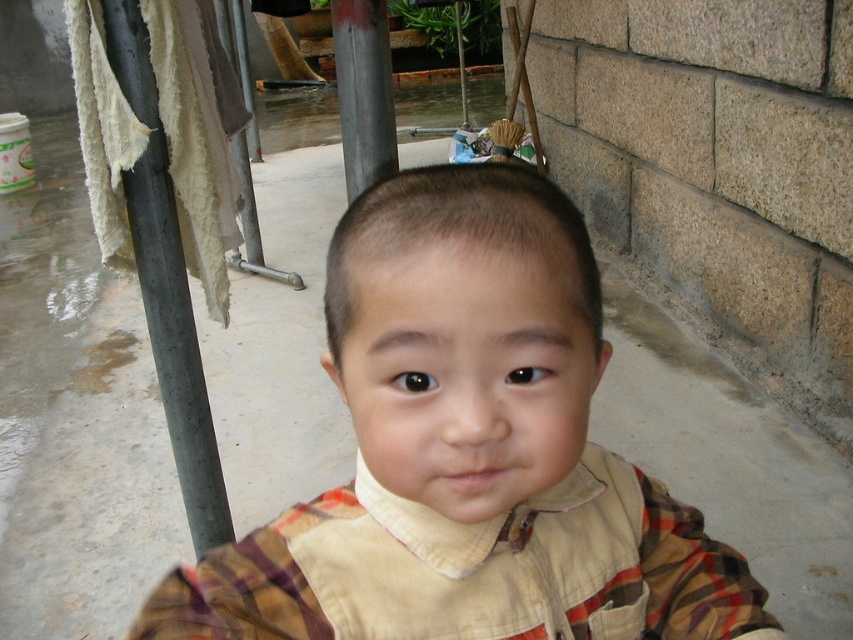
Question: Estimate the real-world distances between objects in this image. Which object is farther from the metallic pole at upper center?

Choices:
 (A) light brown fabric shirt at center
 (B) plaid fabric at center
 (C) metallic gray pole at left

Answer: (C)

Question: Is light brown fabric shirt at center positioned before metallic gray pole at left?

Choices:
 (A) no
 (B) yes

Answer: (B)

Question: Does light brown fabric shirt at center lie in front of plaid fabric at center?

Choices:
 (A) no
 (B) yes

Answer: (B)

Question: Which point is closer to the camera taking this photo?

Choices:
 (A) (x=503, y=193)
 (B) (x=358, y=120)

Answer: (A)

Question: Is light brown fabric shirt at center below plaid fabric at center?

Choices:
 (A) yes
 (B) no

Answer: (B)

Question: Which object is positioned farthest from the metallic gray pole at left?

Choices:
 (A) light brown fabric shirt at center
 (B) plaid fabric at center
 (C) metallic pole at upper center

Answer: (A)